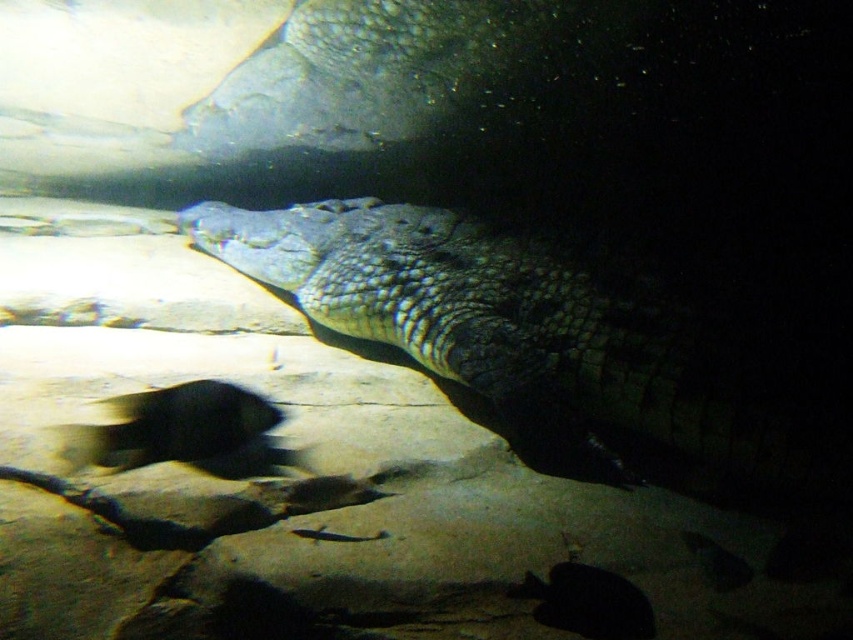
Question: Where is scaly greenish-brown crocodile at center located in relation to black glossy fish at lower left in the image?

Choices:
 (A) right
 (B) left

Answer: (A)

Question: Does scaly greenish-brown crocodile at center come behind black glossy fish at lower left?

Choices:
 (A) no
 (B) yes

Answer: (B)

Question: Which point appears closest to the camera in this image?

Choices:
 (A) (207, 438)
 (B) (566, 406)

Answer: (A)

Question: Does scaly greenish-brown crocodile at center have a greater width compared to black glossy fish at lower left?

Choices:
 (A) yes
 (B) no

Answer: (A)

Question: Which of the following is the closest to the observer?

Choices:
 (A) scaly greenish-brown crocodile at center
 (B) black glossy fish at lower left

Answer: (B)